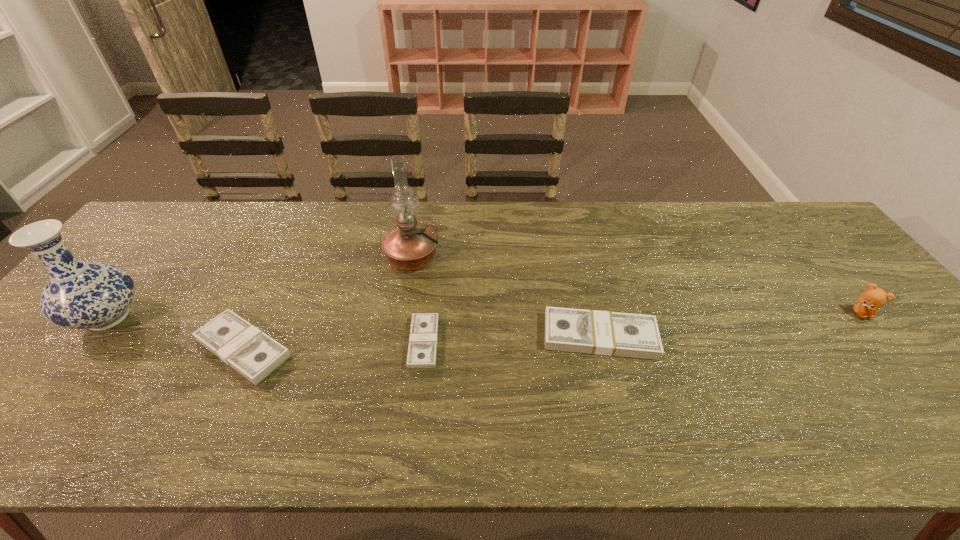
The height and width of the screenshot is (540, 960). Find the location of `free space at the far edge`. free space at the far edge is located at coordinates (729, 213).

The height and width of the screenshot is (540, 960). I want to click on vacant region at the near edge of the desktop, so click(876, 392).

What are the coordinates of `unoccupied position between the fifth object from left to right and the rightmost object` in the screenshot? It's located at (x=731, y=325).

Identify the location of free space between the farthest object and the shortest object. (418, 300).

The image size is (960, 540). I want to click on free space between the second object from left to right and the fifth shortest object, so click(x=176, y=333).

Where is `vacant region between the second object from left to right and the vase`? vacant region between the second object from left to right and the vase is located at coordinates (176, 333).

I want to click on vacant space in between the second object from right to left and the oil lamp, so click(x=506, y=297).

What are the coordinates of `free space between the second object from right to left and the farthest object` in the screenshot? It's located at (506, 297).

Where is `free space between the shortest dollar and the oil lamp`? This screenshot has height=540, width=960. free space between the shortest dollar and the oil lamp is located at coordinates (418, 300).

Locate an element on the screen. This screenshot has width=960, height=540. blank region between the rightmost object and the second tallest object is located at coordinates (485, 315).